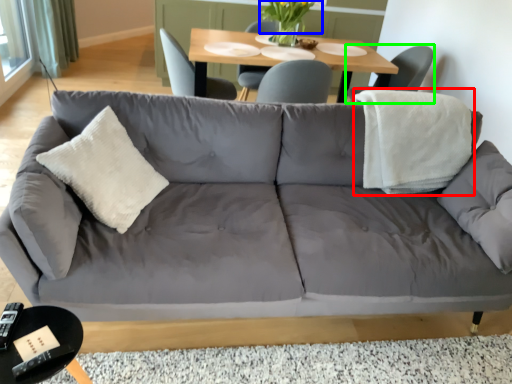
Question: Considering the real-world distances, which object is closest to blanket (highlighted by a red box)? flower (highlighted by a blue box) or chair (highlighted by a green box).

Choices:
 (A) flower
 (B) chair

Answer: (B)